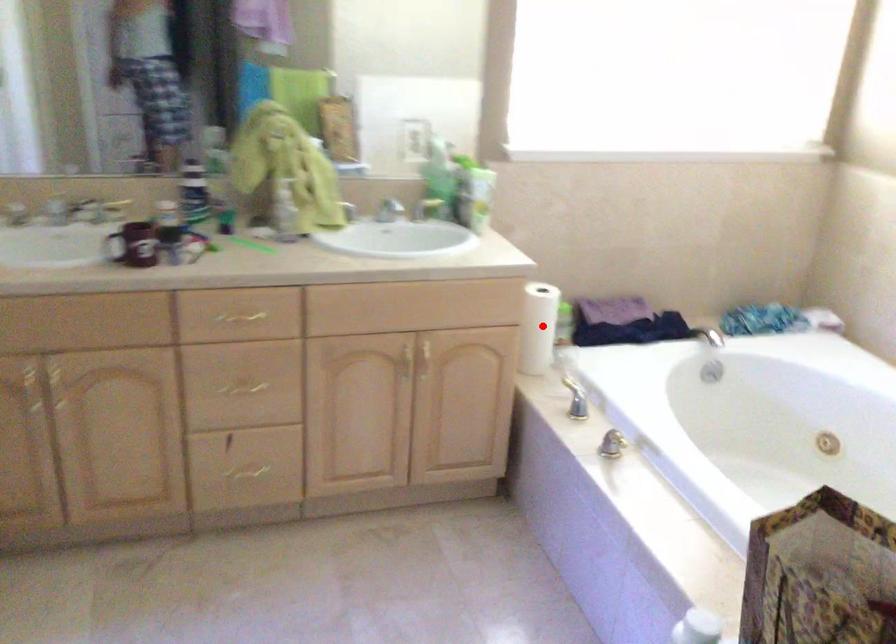
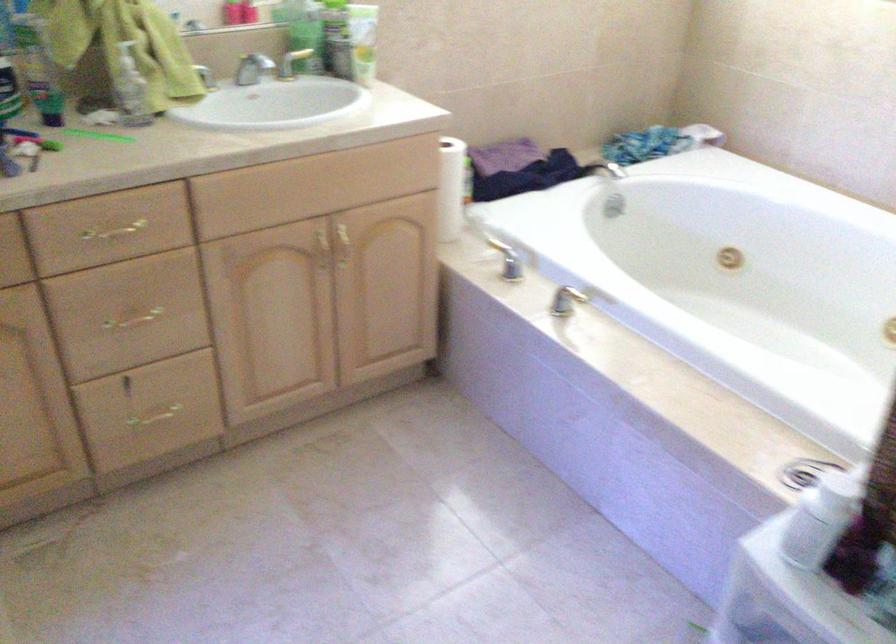
Question: I am providing you with two images of the same scene from different viewpoints. Given a red point in image1, look at the same physical point in image2. Is it:

Choices:
 (A) Closer to the viewpoint
 (B) Farther from the viewpoint

Answer: (A)